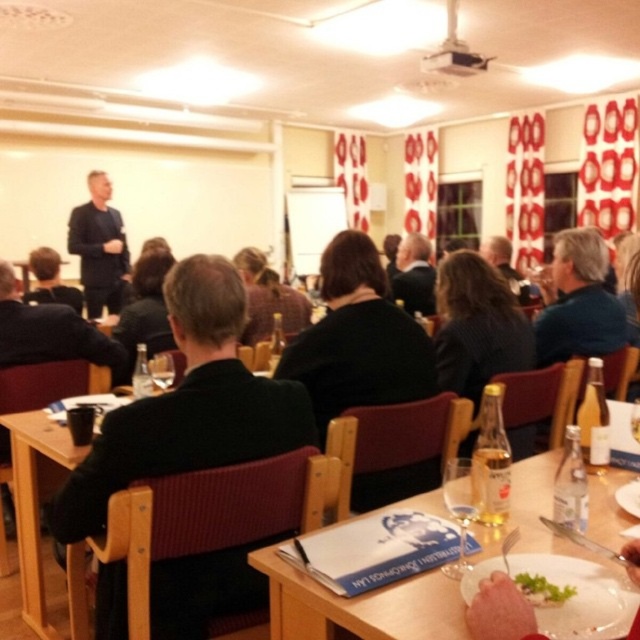
Question: Which of the following is the closest to the observer?

Choices:
 (A) (196, 570)
 (B) (454, 561)
 (C) (168, 372)
 (D) (524, 492)

Answer: (B)

Question: In this image, where is black fabric jacket at center located relative to dark blue shirt at center?

Choices:
 (A) below
 (B) above

Answer: (A)

Question: Is dark blue shirt at center closer to the viewer compared to clear glass wine glass at center?

Choices:
 (A) yes
 (B) no

Answer: (B)

Question: Which object appears closest to the camera in this image?

Choices:
 (A) dark brown leather jacket at left
 (B) wooden table at lower center
 (C) clear glass wine glass at center

Answer: (B)

Question: Is dark blue shirt at center positioned at the back of dark brown leather jacket at left?

Choices:
 (A) yes
 (B) no

Answer: (A)

Question: Which object appears farthest from the camera in this image?

Choices:
 (A) clear glass wine glass at center
 (B) green leafy salad at lower center

Answer: (A)